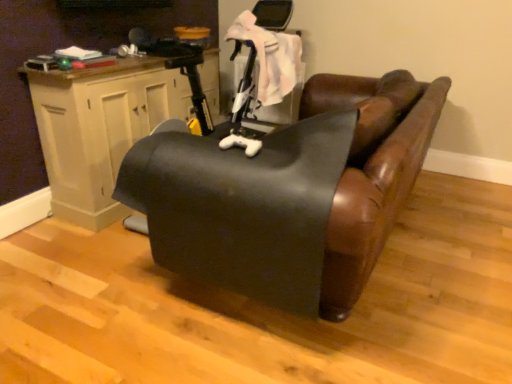
Question: Considering the positions of black leather couch at center and wooden cabinet at left in the image, is black leather couch at center wider or thinner than wooden cabinet at left?

Choices:
 (A) thin
 (B) wide

Answer: (B)

Question: Is point (166, 200) positioned closer to the camera than point (203, 82)?

Choices:
 (A) farther
 (B) closer

Answer: (B)

Question: From the image's perspective, is black leather couch at center located above or below wooden cabinet at left?

Choices:
 (A) below
 (B) above

Answer: (A)

Question: In terms of width, does wooden cabinet at left look wider or thinner when compared to black leather couch at center?

Choices:
 (A) thin
 (B) wide

Answer: (A)

Question: Is wooden cabinet at left to the left or to the right of black leather couch at center in the image?

Choices:
 (A) left
 (B) right

Answer: (A)

Question: From a real-world perspective, is wooden cabinet at left above or below black leather couch at center?

Choices:
 (A) below
 (B) above

Answer: (B)

Question: Based on their sizes in the image, would you say wooden cabinet at left is bigger or smaller than black leather couch at center?

Choices:
 (A) big
 (B) small

Answer: (B)